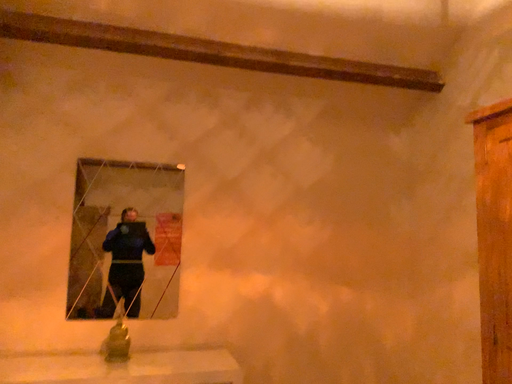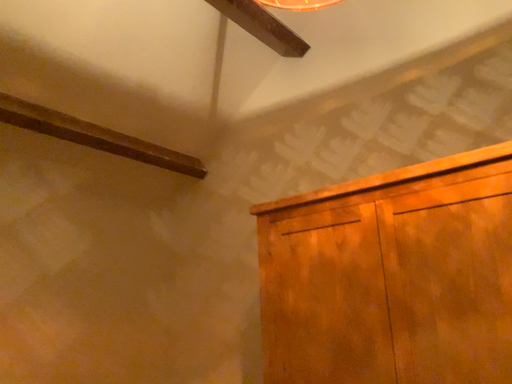
Question: Which way did the camera rotate in the video?

Choices:
 (A) rotated upward
 (B) rotated downward

Answer: (A)